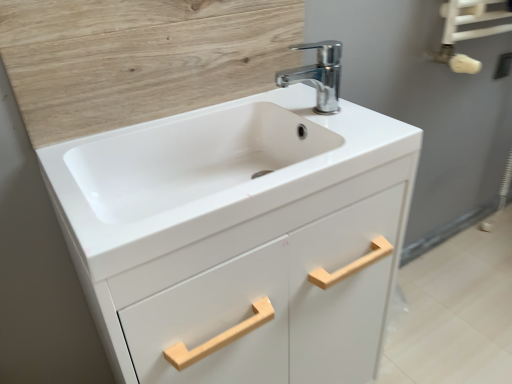
Locate an element on the screen. This screenshot has width=512, height=384. free area below white glossy towel rack at upper right (from a real-world perspective) is located at coordinates (463, 249).